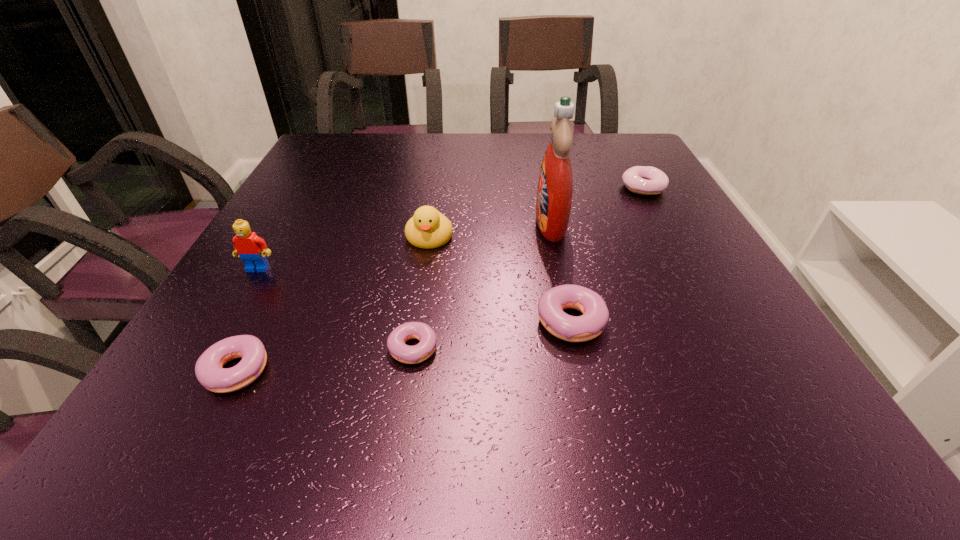
Where is `free spot between the shortest object and the fifth shortest object`? free spot between the shortest object and the fifth shortest object is located at coordinates (421, 291).

This screenshot has height=540, width=960. Find the location of `unoccupied area between the leftmost doughnut and the Lego`. unoccupied area between the leftmost doughnut and the Lego is located at coordinates (248, 320).

This screenshot has height=540, width=960. In order to click on vacant area that lies between the third doughnut from left to right and the fourth farthest object in this screenshot , I will do `click(415, 294)`.

I want to click on free spot between the farthest object and the detergent, so click(597, 206).

This screenshot has height=540, width=960. Identify the location of vacant space that's between the shortest object and the duckling. (421, 291).

Where is `free spot between the third tallest doughnut and the shortest object`? The height and width of the screenshot is (540, 960). free spot between the third tallest doughnut and the shortest object is located at coordinates (326, 357).

The width and height of the screenshot is (960, 540). Identify the location of empty space that is in between the detergent and the duckling. (490, 230).

You are a GUI agent. You are given a task and a screenshot of the screen. Output one action in this format:
    pyautogui.click(x=<x>, y=<y>)
    Task: Click on the vacant space in between the second doughnut from right to left and the third doughnut from right to left
    
    Given the screenshot: What is the action you would take?
    pyautogui.click(x=492, y=332)

Locate an element on the screen. Image resolution: width=960 pixels, height=540 pixels. empty space between the detergent and the second doughnut from right to left is located at coordinates (561, 272).

Locate an element on the screen. This screenshot has width=960, height=540. empty space between the second tallest object and the tallest object is located at coordinates (404, 246).